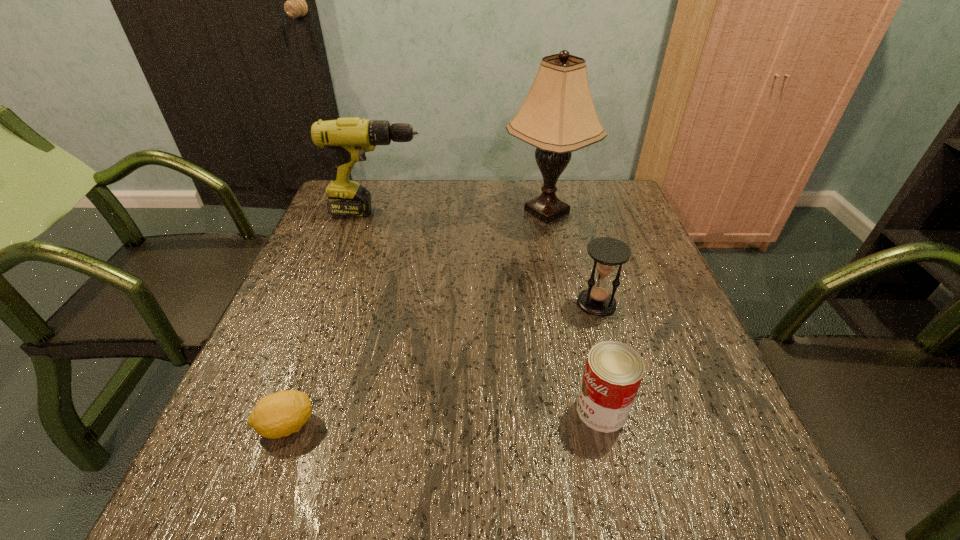
Image resolution: width=960 pixels, height=540 pixels. What are the coordinates of `vacant region at the far edge of the desktop` in the screenshot? It's located at (394, 196).

At what (x,y) coordinates should I click in order to perform the action: click on vacant space at the near edge of the desktop. Please return your answer as a coordinate pair (x, y). This screenshot has height=540, width=960. Looking at the image, I should click on (573, 521).

Image resolution: width=960 pixels, height=540 pixels. Identify the location of vacant space at the left edge. (355, 226).

Locate an element on the screen. vacant space at the right edge of the desktop is located at coordinates (633, 318).

Find the location of `blank space at the far right corner of the desktop`. blank space at the far right corner of the desktop is located at coordinates (574, 183).

Locate an element on the screen. The height and width of the screenshot is (540, 960). vacant space that is in between the shortest object and the fourth shortest object is located at coordinates (332, 319).

Locate an element on the screen. The image size is (960, 540). vacant space that is in between the hourglass and the lamp is located at coordinates (571, 258).

Identify the location of vacant point located between the hourglass and the drill. (488, 258).

Locate an element on the screen. This screenshot has height=540, width=960. vacant space that is in between the tallest object and the shortest object is located at coordinates (x=417, y=318).

In order to click on free spot between the lemon and the hourglass in this screenshot , I will do `click(442, 364)`.